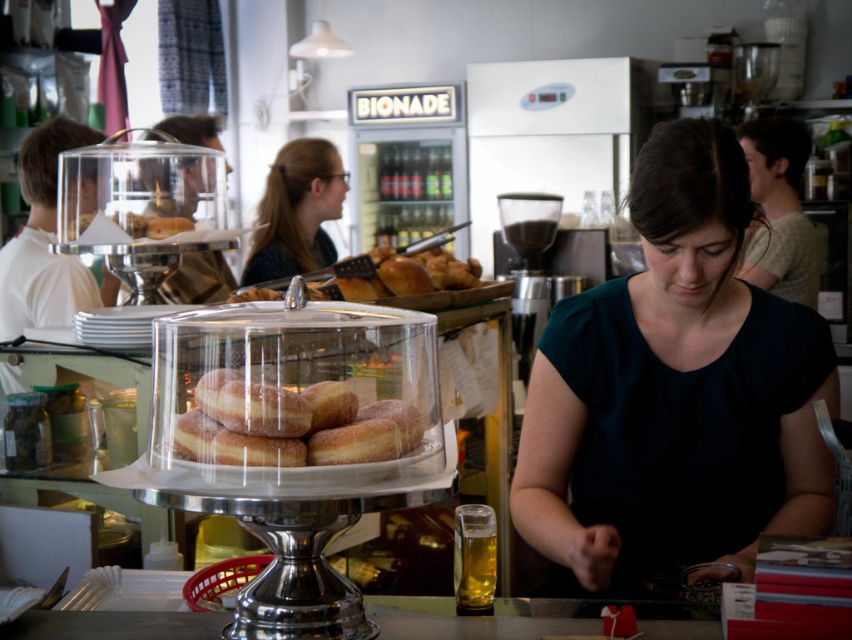
Is light beige shirt at upper right smaller than sugared doughnut at center?

No.

Which is in front, point (776, 234) or point (366, 419)?

Point (366, 419)

The height and width of the screenshot is (640, 852). I want to click on light beige shirt at upper right, so click(x=779, y=211).

Who is more distant from viewer, (320, 419) or (753, 131)?

The point (753, 131) is more distant.

Who is shorter, sugared doughnuts at center or light beige shirt at upper right?

sugared doughnuts at center is shorter.

Between point (269, 406) and point (781, 252), which one is positioned in front?

Point (269, 406) is more forward.

The image size is (852, 640). I want to click on sugared doughnuts at center, so click(291, 424).

Can you confirm if dark green blouse at center is shorter than light beige shirt at upper right?

Incorrect, dark green blouse at center's height does not fall short of light beige shirt at upper right's.

Where is `dark green blouse at center`? The height and width of the screenshot is (640, 852). dark green blouse at center is located at coordinates (676, 392).

Identify the location of dark green blouse at center. The image size is (852, 640). (676, 392).